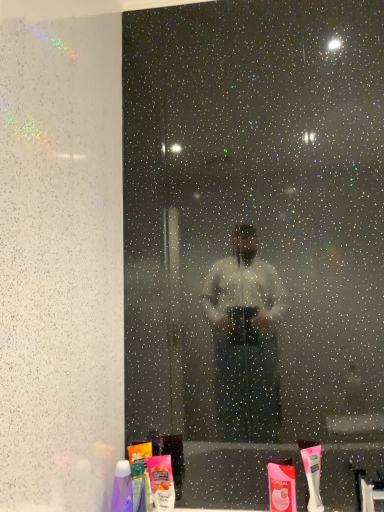
Question: Is purple glossy bottle at lower left, arranged as the 1th toiletry when viewed from the left, smaller than matte pink plastic toothpaste at lower center, which is the 3th toiletry from left to right?

Choices:
 (A) no
 (B) yes

Answer: (A)

Question: From the image's perspective, would you say purple glossy bottle at lower left, arranged as the 1th toiletry when viewed from the left, is shown under matte pink plastic toothpaste at lower center, arranged as the first toiletry when viewed from the right?

Choices:
 (A) yes
 (B) no

Answer: (B)

Question: Is purple glossy bottle at lower left, arranged as the 1th toiletry when viewed from the left, closer to camera compared to matte pink plastic toothpaste at lower center, arranged as the first toiletry when viewed from the right?

Choices:
 (A) yes
 (B) no

Answer: (A)

Question: Can you confirm if purple glossy bottle at lower left, which appears as the 3th toiletry when viewed from the right, is positioned to the right of matte pink plastic toothpaste at lower center, which is the 3th toiletry from left to right?

Choices:
 (A) yes
 (B) no

Answer: (B)

Question: From the image's perspective, does purple glossy bottle at lower left, which appears as the 3th toiletry when viewed from the right, appear higher than matte pink plastic toothpaste at lower center, arranged as the first toiletry when viewed from the right?

Choices:
 (A) yes
 (B) no

Answer: (A)

Question: Is purple glossy bottle at lower left, arranged as the 1th toiletry when viewed from the left, positioned beyond the bounds of matte pink plastic toothpaste at lower center, which is the 3th toiletry from left to right?

Choices:
 (A) no
 (B) yes

Answer: (B)

Question: From the image's perspective, is white plastic toothbrush at lower right above purple glossy bottle at lower left, which appears as the 3th toiletry when viewed from the right?

Choices:
 (A) no
 (B) yes

Answer: (B)

Question: Is white plastic toothbrush at lower right taller than purple glossy bottle at lower left, which appears as the 3th toiletry when viewed from the right?

Choices:
 (A) no
 (B) yes

Answer: (B)

Question: Considering the relative positions of white plastic toothbrush at lower right and purple glossy bottle at lower left, arranged as the 1th toiletry when viewed from the left, in the image provided, is white plastic toothbrush at lower right in front of purple glossy bottle at lower left, arranged as the 1th toiletry when viewed from the left,?

Choices:
 (A) no
 (B) yes

Answer: (A)

Question: Is white plastic toothbrush at lower right at the left side of purple glossy bottle at lower left, arranged as the 1th toiletry when viewed from the left?

Choices:
 (A) yes
 (B) no

Answer: (B)

Question: Could you tell me if white plastic toothbrush at lower right is turned towards purple glossy bottle at lower left, arranged as the 1th toiletry when viewed from the left?

Choices:
 (A) yes
 (B) no

Answer: (B)

Question: From the image's perspective, does white plastic toothbrush at lower right appear lower than purple glossy bottle at lower left, arranged as the 1th toiletry when viewed from the left?

Choices:
 (A) no
 (B) yes

Answer: (A)

Question: Considering the relative positions of matte pink plastic toothpaste at lower center, which is the 3th toiletry from left to right, and pink matte lotion at lower center, marked as the second toiletry in a left-to-right arrangement, in the image provided, is matte pink plastic toothpaste at lower center, which is the 3th toiletry from left to right, to the right of pink matte lotion at lower center, marked as the second toiletry in a left-to-right arrangement, from the viewer's perspective?

Choices:
 (A) yes
 (B) no

Answer: (A)